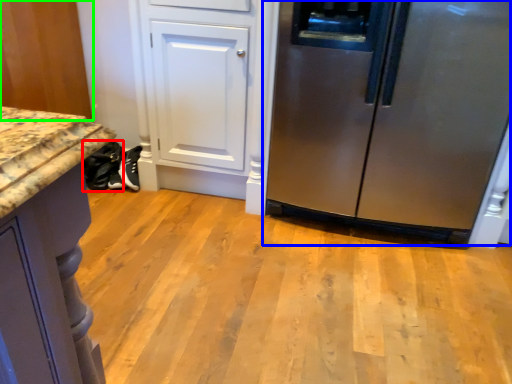
Question: Based on their relative distances, which object is farther from footwear (highlighted by a red box)? Choose from refrigerator (highlighted by a blue box) and cabinetry (highlighted by a green box).

Choices:
 (A) refrigerator
 (B) cabinetry

Answer: (A)